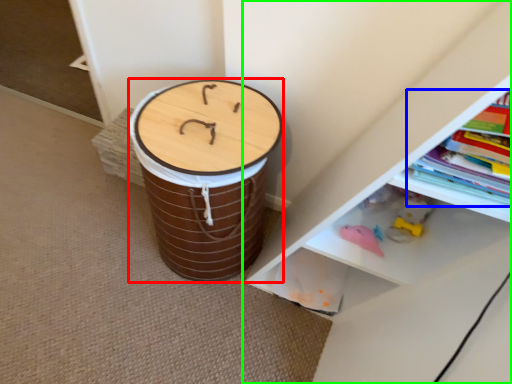
Question: Estimate the real-world distances between objects in this image. Which object is closer to drum (highlighted by a red box), book (highlighted by a blue box) or shelf (highlighted by a green box)?

Choices:
 (A) book
 (B) shelf

Answer: (B)